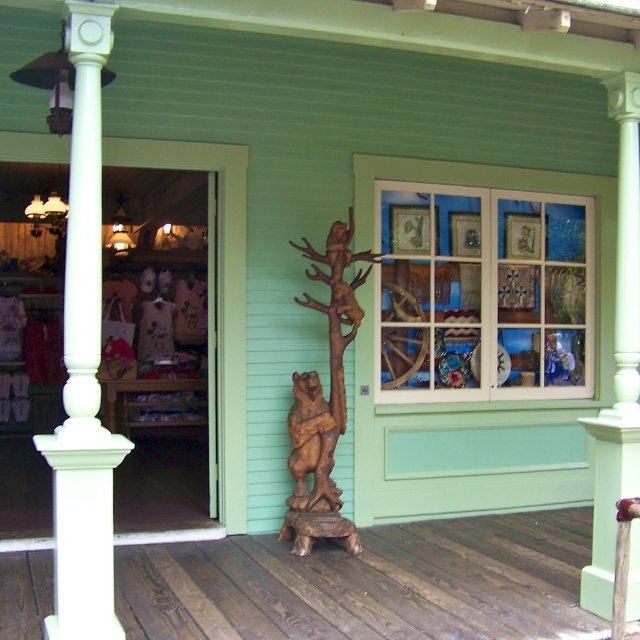
The width and height of the screenshot is (640, 640). What do you see at coordinates (83, 365) in the screenshot?
I see `white painted wood column at left` at bounding box center [83, 365].

Identify the location of white painted wood column at left. (83, 365).

Does wooden bench at center have a lesser width compared to brown wood bear at center?

No.

Which is behind, point (369, 618) or point (308, 401)?

The point (308, 401) is more distant.

Does point (422, 621) come in front of point (305, 488)?

Yes, point (422, 621) is closer to viewer.

The width and height of the screenshot is (640, 640). Find the location of `wooden bench at center`. wooden bench at center is located at coordinates (369, 584).

Which of these two, white painted wood column at left or brown wood bear at center, stands taller?

white painted wood column at left

Image resolution: width=640 pixels, height=640 pixels. What are the coordinates of `white painted wood column at left` in the screenshot? It's located at (83, 365).

Locate an element on the screen. The height and width of the screenshot is (640, 640). white painted wood column at left is located at coordinates (83, 365).